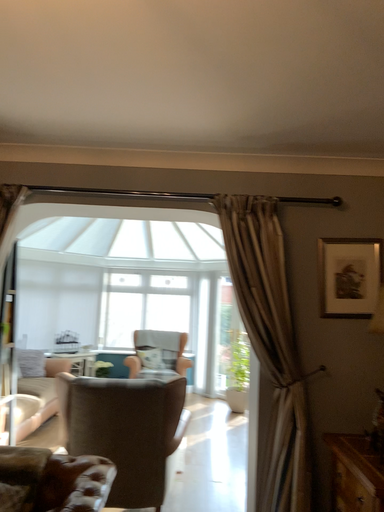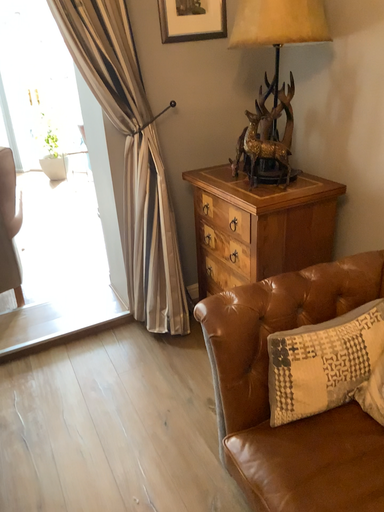
Question: How did the camera likely rotate when shooting the video?

Choices:
 (A) rotated right
 (B) rotated left

Answer: (A)